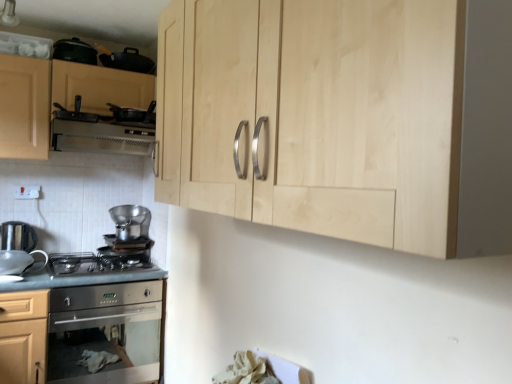
You are a GUI agent. You are given a task and a screenshot of the screen. Output one action in this format:
    pyautogui.click(x=<x>, y=<y>)
    Task: Click on the satin silver gas stove at lower left
    
    Given the screenshot: What is the action you would take?
    pyautogui.click(x=99, y=262)

What do you see at coordinates (82, 325) in the screenshot? The height and width of the screenshot is (384, 512). I see `stainless steel countertop at lower left` at bounding box center [82, 325].

This screenshot has width=512, height=384. Describe the element at coordinates (75, 51) in the screenshot. I see `matte black pan at upper left, which is the fifth appliance from bottom to top` at that location.

Where is `white plastic electric outlet at lower left`? white plastic electric outlet at lower left is located at coordinates (27, 192).

Where is `matte wood cabinet at upper left, marked as the first cabinetry in a back-to-front arrangement`? matte wood cabinet at upper left, marked as the first cabinetry in a back-to-front arrangement is located at coordinates (56, 98).

This screenshot has width=512, height=384. In order to click on satin silver gas stove at lower left in this screenshot , I will do `click(99, 262)`.

Is matte wood cabinet at upper left, marked as the first cabinetry in a back-to-front arrangement, spatially inside matte black pan at upper left, the first appliance positioned from the top, or outside of it?

matte wood cabinet at upper left, marked as the first cabinetry in a back-to-front arrangement, is spatially situated outside matte black pan at upper left, the first appliance positioned from the top.

Locate an element on the screen. This screenshot has width=512, height=384. appliance that is the 2nd one when counting upward from the matte wood cabinet at upper left, the second cabinetry when ordered from right to left (from the image's perspective) is located at coordinates (75, 51).

Is matte wood cabinet at upper left, marked as the first cabinetry in a back-to-front arrangement, oriented towards matte black pan at upper left, which is the fifth appliance from bottom to top?

No, matte wood cabinet at upper left, marked as the first cabinetry in a back-to-front arrangement, is not facing towards matte black pan at upper left, which is the fifth appliance from bottom to top.

Considering the points (16, 140) and (73, 39), which point is behind, point (16, 140) or point (73, 39)?

The point (73, 39) is more distant.

Is metallic silver pan at upper left, the 3th appliance when ordered from bottom to top, completely or partially inside white plastic electric outlet at lower left?

Actually, metallic silver pan at upper left, the 3th appliance when ordered from bottom to top, is outside white plastic electric outlet at lower left.

Considering the points (26, 198) and (109, 108), which point is in front, point (26, 198) or point (109, 108)?

The point (109, 108) is more forward.

Is white plastic electric outlet at lower left far from metallic silver pan at upper left, the 3th appliance when ordered from bottom to top?

No.

How many degrees apart are the facing directions of white plastic electric outlet at lower left and metallic silver pan at upper left, the 3th appliance when ordered from bottom to top?

The angular difference between white plastic electric outlet at lower left and metallic silver pan at upper left, the 3th appliance when ordered from bottom to top, is 0.739 degrees.

Considering the relative positions of white plastic electric outlet at lower left and matte wood cabinet at upper left, which is the 1th cabinetry from left to right, in the image provided, is white plastic electric outlet at lower left in front of matte wood cabinet at upper left, which is the 1th cabinetry from left to right,?

No, white plastic electric outlet at lower left is behind matte wood cabinet at upper left, which is the 1th cabinetry from left to right.

Do you think white plastic electric outlet at lower left is within matte wood cabinet at upper left, which is counted as the 2th cabinetry, starting from the front, or outside of it?

Answer: white plastic electric outlet at lower left is spatially situated outside matte wood cabinet at upper left, which is counted as the 2th cabinetry, starting from the front.

How much distance is there between white plastic electric outlet at lower left and matte wood cabinet at upper left, the second cabinetry when ordered from right to left?

white plastic electric outlet at lower left and matte wood cabinet at upper left, the second cabinetry when ordered from right to left, are 24.49 inches apart.

Where is `electric outlet on the left of matte wood cabinet at upper left, the second cabinetry when ordered from right to left`? Image resolution: width=512 pixels, height=384 pixels. electric outlet on the left of matte wood cabinet at upper left, the second cabinetry when ordered from right to left is located at coordinates (27, 192).

Measure the distance from white plastic exhaust hood at upper left to satin silver kettle at lower left, the first appliance in the bottom-to-top sequence.

They are 27.13 inches apart.

Does white plastic exhaust hood at upper left lie behind satin silver kettle at lower left, the first appliance in the bottom-to-top sequence?

No, white plastic exhaust hood at upper left is closer to the viewer.

Between point (57, 138) and point (23, 249), which one is positioned behind?

The point (23, 249) is more distant.

Can you confirm if white plastic exhaust hood at upper left is positioned to the left of satin silver kettle at lower left, the first appliance in the bottom-to-top sequence?

No, white plastic exhaust hood at upper left is not to the left of satin silver kettle at lower left, the first appliance in the bottom-to-top sequence.

Where is `countertop in front of the satin silver pot at center, the 2th appliance positioned from the bottom`? The height and width of the screenshot is (384, 512). countertop in front of the satin silver pot at center, the 2th appliance positioned from the bottom is located at coordinates (82, 325).

Is satin silver pot at center, the 2th appliance positioned from the bottom, next to stainless steel countertop at lower left and touching it?

satin silver pot at center, the 2th appliance positioned from the bottom, and stainless steel countertop at lower left are not in contact.

Is satin silver pot at center, the 2th appliance positioned from the bottom, shorter than stainless steel countertop at lower left?

Yes.

Is satin silver kettle at lower left, the first appliance in the bottom-to-top sequence, inside or outside of satin silver gas stove at lower left?

satin silver kettle at lower left, the first appliance in the bottom-to-top sequence, is not inside satin silver gas stove at lower left, it's outside.

You are a GUI agent. You are given a task and a screenshot of the screen. Output one action in this format:
    pyautogui.click(x=<x>, y=<y>)
    Task: Click on the 1st appliance located above the satin silver gas stove at lower left (from a real-world perspective)
    This screenshot has height=384, width=512.
    Given the screenshot: What is the action you would take?
    pyautogui.click(x=18, y=247)

Measure the distance from satin silver kettle at lower left, the first appliance in the bottom-to-top sequence, to satin silver gas stove at lower left.

satin silver kettle at lower left, the first appliance in the bottom-to-top sequence, is 11.62 inches from satin silver gas stove at lower left.

Based on the photo, from the image's perspective, is satin silver kettle at lower left, the first appliance in the bottom-to-top sequence, above satin silver gas stove at lower left?

Correct, satin silver kettle at lower left, the first appliance in the bottom-to-top sequence, appears higher than satin silver gas stove at lower left in the image.

Between satin silver gas stove at lower left and matte wood cabinet at upper left, marked as the first cabinetry in a back-to-front arrangement, which one has smaller width?

With smaller width is matte wood cabinet at upper left, marked as the first cabinetry in a back-to-front arrangement.

From the image's perspective, is satin silver gas stove at lower left below matte wood cabinet at upper left, marked as the first cabinetry in a back-to-front arrangement?

Yes, from the image's perspective, satin silver gas stove at lower left is below matte wood cabinet at upper left, marked as the first cabinetry in a back-to-front arrangement.

From the picture: Is satin silver gas stove at lower left positioned behind matte wood cabinet at upper left, which is the 1th cabinetry from left to right?

No, satin silver gas stove at lower left is in front of matte wood cabinet at upper left, which is the 1th cabinetry from left to right.

Is satin silver gas stove at lower left to the left or to the right of matte wood cabinet at upper left, which is counted as the 2th cabinetry, starting from the front, in the image?

From the image, it's evident that satin silver gas stove at lower left is to the right of matte wood cabinet at upper left, which is counted as the 2th cabinetry, starting from the front.

Image resolution: width=512 pixels, height=384 pixels. There is a matte wood cabinet at upper left, marked as the first cabinetry in a back-to-front arrangement. Find the location of `the 3rd appliance above it (from a real-world perspective)`. the 3rd appliance above it (from a real-world perspective) is located at coordinates click(x=75, y=51).

I want to click on electric outlet lying behind the metallic silver pan at upper left, the 3th appliance when ordered from bottom to top, so click(x=27, y=192).

Based on their spatial positions, is white plastic electric outlet at lower left or matte wood cabinet at upper left, which is counted as the 2th cabinetry, starting from the front, further from satin silver pot at center, the 2th appliance positioned from the bottom?

Among the two, matte wood cabinet at upper left, which is counted as the 2th cabinetry, starting from the front, is located further to satin silver pot at center, the 2th appliance positioned from the bottom.

Estimate the real-world distances between objects in this image. Which object is closer to natural wood cabinet at upper center, which appears as the 1th cabinetry when viewed from the front, black matte frying pan at upper left, the 4th appliance when ordered from bottom to top, or stainless steel countertop at lower left?

stainless steel countertop at lower left.

Considering their positions, is satin silver gas stove at lower left positioned further to white plastic exhaust hood at upper left than black matte frying pan at upper left, the 4th appliance when ordered from bottom to top?

Among the two, satin silver gas stove at lower left is located further to white plastic exhaust hood at upper left.

When comparing their distances from satin silver gas stove at lower left, does natural wood cabinet at upper center, which appears as the 1th cabinetry when viewed from the front, or matte black pan at upper left, which is the fifth appliance from bottom to top, seem further?

natural wood cabinet at upper center, which appears as the 1th cabinetry when viewed from the front, lies further to satin silver gas stove at lower left than the other object.

Based on the photo, which object lies nearer to the anchor point white plastic electric outlet at lower left, stainless steel countertop at lower left or matte black pan at upper left, which is the fifth appliance from bottom to top?

matte black pan at upper left, which is the fifth appliance from bottom to top, is closer to white plastic electric outlet at lower left.

Which object lies further to the anchor point satin silver gas stove at lower left, satin silver kettle at lower left, the first appliance in the bottom-to-top sequence, or white plastic exhaust hood at upper left?

white plastic exhaust hood at upper left lies further to satin silver gas stove at lower left than the other object.

Based on their spatial positions, is matte black pan at upper left, which is the fifth appliance from bottom to top, or satin silver pot at center, which appears as the 4th appliance when viewed from the top, closer to stainless steel countertop at lower left?

The object closer to stainless steel countertop at lower left is satin silver pot at center, which appears as the 4th appliance when viewed from the top.

Based on the photo, based on their spatial positions, is natural wood cabinet at upper center, the 2th cabinetry viewed from the left, or white plastic electric outlet at lower left further from metallic silver pan at upper left, the 3th appliance when ordered from bottom to top?

Among the two, natural wood cabinet at upper center, the 2th cabinetry viewed from the left, is located further to metallic silver pan at upper left, the 3th appliance when ordered from bottom to top.

The width and height of the screenshot is (512, 384). I want to click on cabinetry between natural wood cabinet at upper center, the 2th cabinetry viewed from the left, and satin silver kettle at lower left, the 5th appliance viewed from the top, along the z-axis, so click(56, 98).

Locate an element on the screen. The height and width of the screenshot is (384, 512). gas stove that lies between matte wood cabinet at upper left, marked as the first cabinetry in a back-to-front arrangement, and stainless steel countertop at lower left from top to bottom is located at coordinates (99, 262).

What are the coordinates of `electric outlet between matte black pan at upper left, the first appliance positioned from the top, and satin silver gas stove at lower left vertically` in the screenshot? It's located at (27, 192).

Where is `appliance that lies between black matte frying pan at upper left, the 2th appliance from the top, and white plastic electric outlet at lower left from top to bottom`? appliance that lies between black matte frying pan at upper left, the 2th appliance from the top, and white plastic electric outlet at lower left from top to bottom is located at coordinates (133, 113).